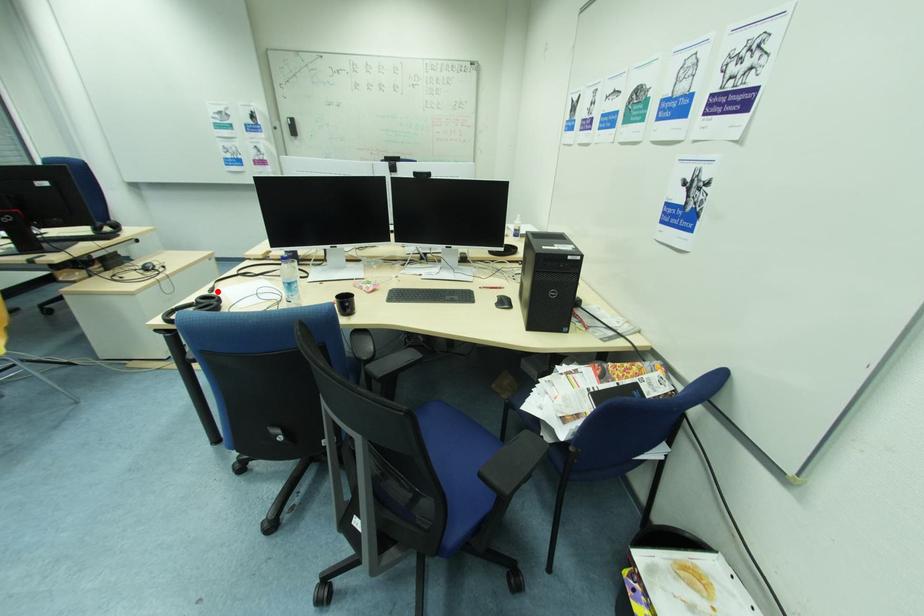
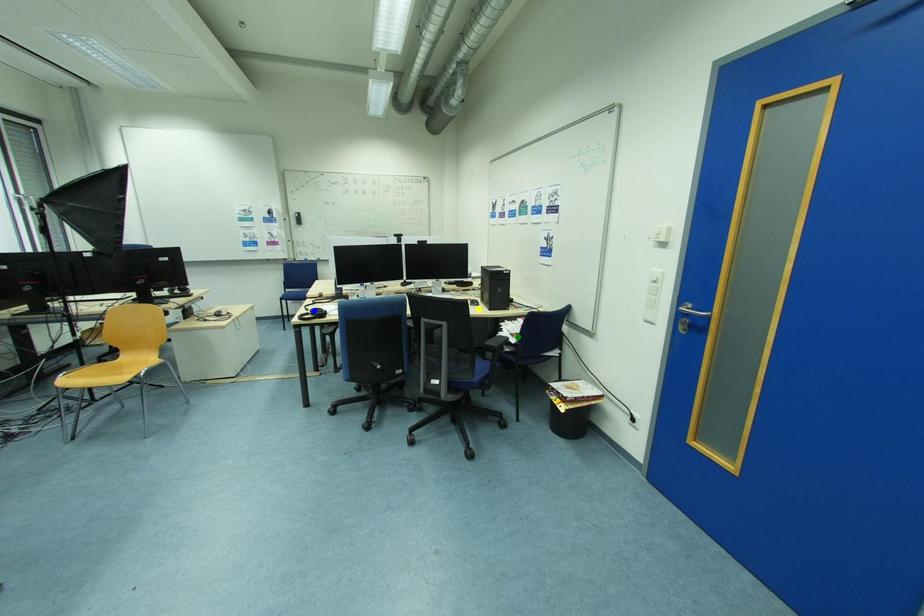
Question: I am providing you with two images of the same scene from different viewpoints. A red point is marked on the first image. You are given multiple points on the second image. Which mark in image 2 goes with the point in image 1?

Choices:
 (A) yellow point
 (B) blue point
 (C) green point

Answer: (B)